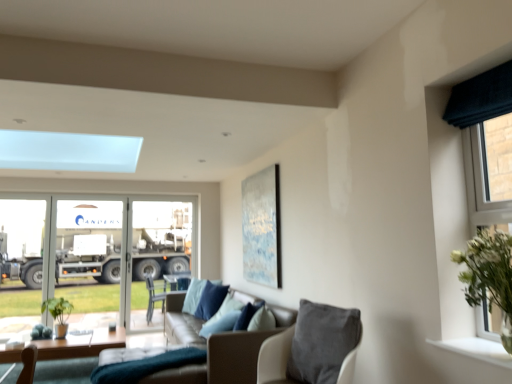
Question: Is suede-like beige chair at lower center taller or shorter than metallic silver trailer truck at left?

Choices:
 (A) tall
 (B) short

Answer: (B)

Question: Choose the correct answer: Is suede-like beige chair at lower center inside metallic silver trailer truck at left or outside it?

Choices:
 (A) outside
 (B) inside

Answer: (A)

Question: Considering the real-world distances, which object is closest to the metallic silver trailer truck at left?

Choices:
 (A) white smooth window sill at lower right
 (B) leather couch at center
 (C) dark blue fabric curtain at right
 (D) leather couch at center
 (E) wooden table at lower left

Answer: (B)

Question: Which of these objects is positioned closest to the leather couch at center?

Choices:
 (A) metallic silver trailer truck at left
 (B) white smooth window sill at lower right
 (C) dark blue fabric curtain at right
 (D) velvet blue pillow at center
 (E) leather couch at center

Answer: (D)